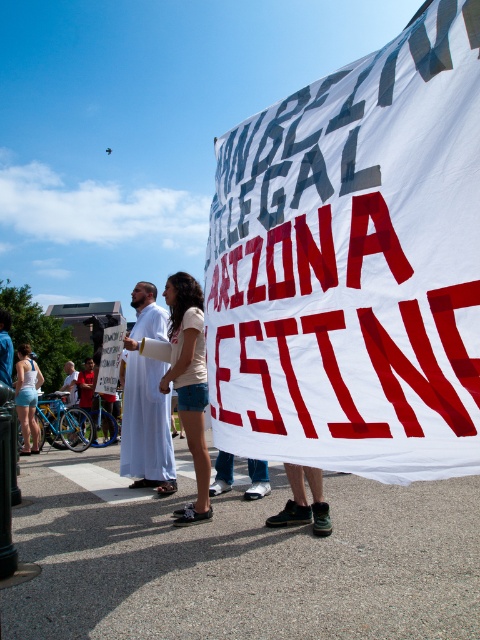
Does matte white shirt at center have a lesser width compared to matte white tank top at lower left?

Correct, matte white shirt at center's width is less than matte white tank top at lower left's.

Between point (188, 362) and point (24, 392), which one is positioned behind?

The point (24, 392) is more distant.

Which is behind, point (204, 484) or point (26, 381)?

Point (26, 381)

This screenshot has height=640, width=480. Identify the location of matte white shirt at center. (189, 384).

Which is more to the left, white fabric banner at center or matte white shirt at center?

matte white shirt at center

Is white fabric banner at center closer to the viewer compared to matte white shirt at center?

Yes.

This screenshot has height=640, width=480. Describe the element at coordinates (354, 262) in the screenshot. I see `white fabric banner at center` at that location.

This screenshot has width=480, height=640. In order to click on white fabric banner at center in this screenshot , I will do `click(354, 262)`.

Does white fabric banner at center have a larger size compared to matte white tank top at lower left?

Incorrect, white fabric banner at center is not larger than matte white tank top at lower left.

Can you confirm if white fabric banner at center is positioned above matte white tank top at lower left?

Yes.

Between point (343, 260) and point (24, 394), which one is positioned behind?

The point (24, 394) is more distant.

Locate an element on the screen. This screenshot has height=640, width=480. white fabric banner at center is located at coordinates (354, 262).